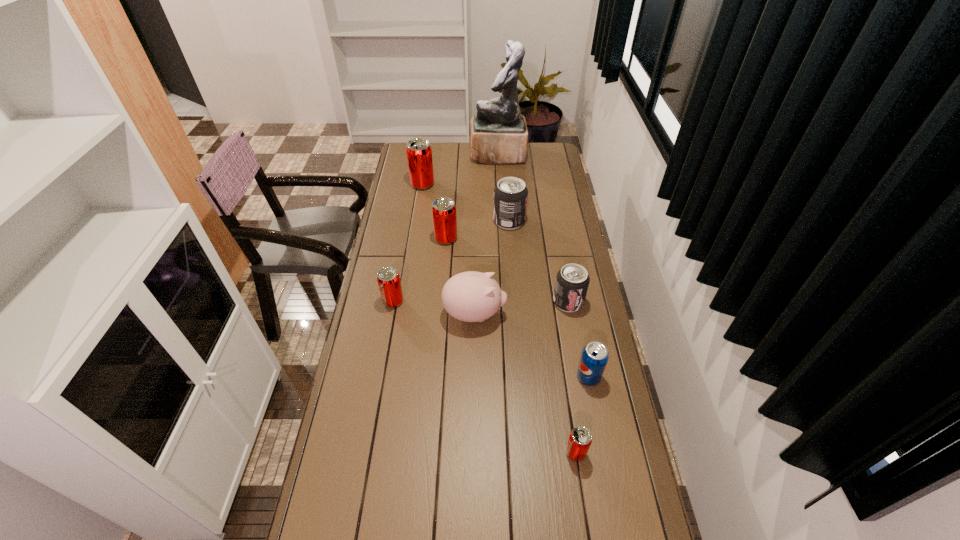
This screenshot has width=960, height=540. I want to click on free point located on the front of the fifth soda can from right to left, so click(x=441, y=301).

Locate an element on the screen. free region located on the back of the fourth soda can from left to right is located at coordinates (507, 188).

Find the location of a particular element. blank space located at the snout of the piggy bank is located at coordinates (541, 314).

This screenshot has width=960, height=540. What are the coordinates of `free space located 0.260m on the front of the smaller black soda can` in the screenshot? It's located at (582, 376).

Image resolution: width=960 pixels, height=540 pixels. In order to click on free region located on the front of the second nearest red soda can in this screenshot , I will do `click(387, 338)`.

This screenshot has width=960, height=540. What are the coordinates of `vacant area located 0.150m on the front of the eighth farthest object` in the screenshot? It's located at (599, 433).

The height and width of the screenshot is (540, 960). I want to click on blank area located 0.360m on the back of the nearest red soda can, so click(559, 341).

Locate an element on the screen. object positioned at the far edge is located at coordinates (499, 135).

Locate an element on the screen. This screenshot has height=540, width=960. free region at the far edge of the desktop is located at coordinates (464, 143).

Image resolution: width=960 pixels, height=540 pixels. Identify the location of free space at the left edge. (387, 313).